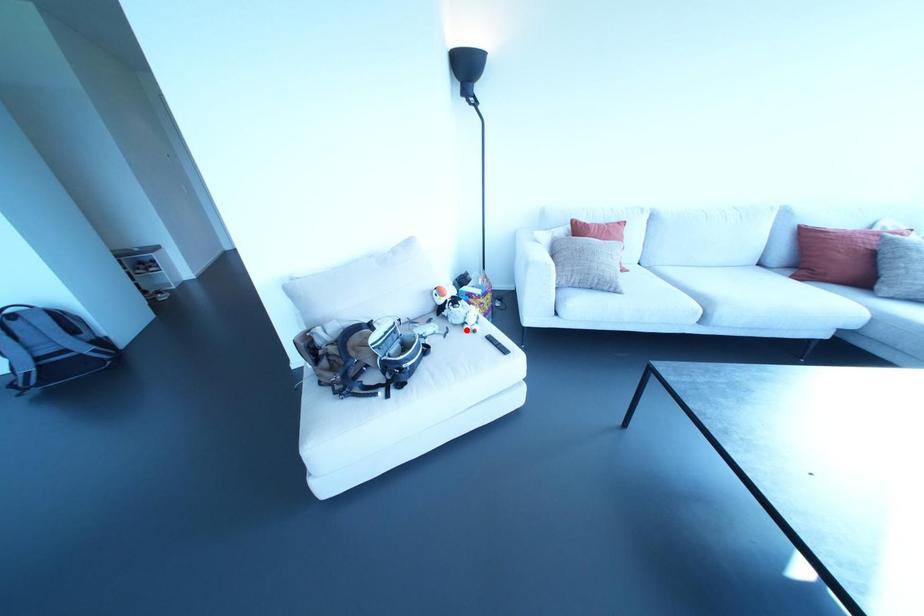
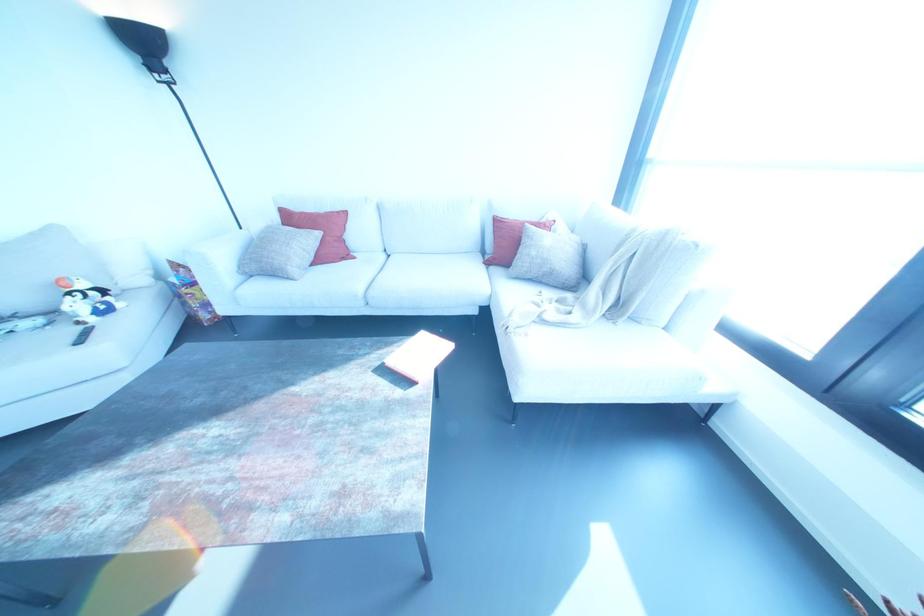
The point at the highlighted location is marked in the first image. Where is the corresponding point in the second image?

(78, 322)